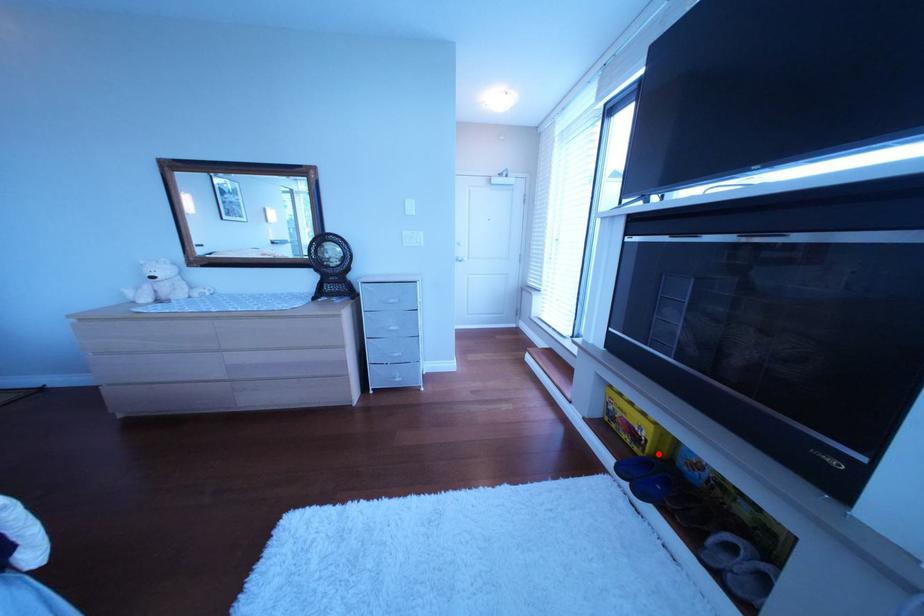
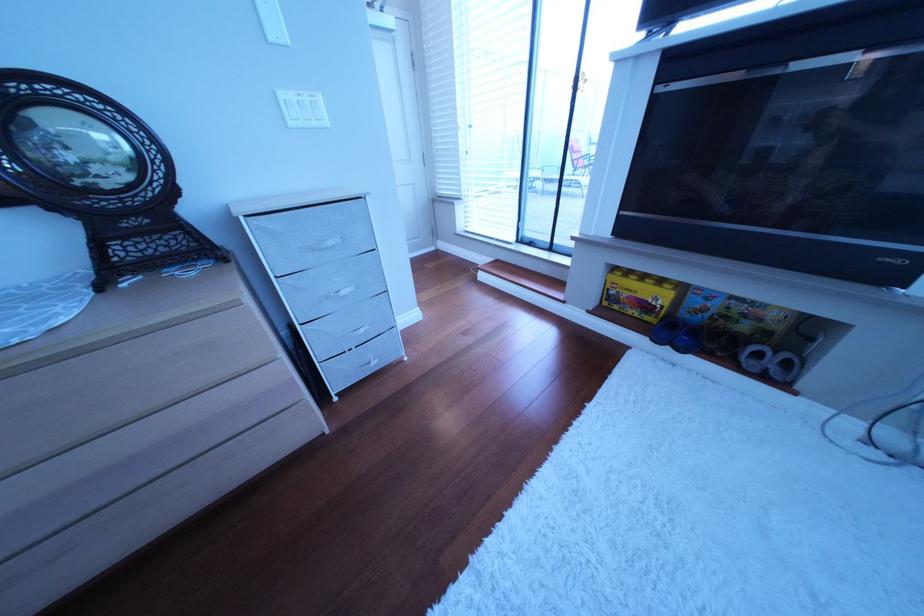
Question: I am providing you with two images of the same scene from different viewpoints. Image1 has a red point marked. In image2, the corresponding 3D location appears at what relative position? Reply with the corresponding letter.

Choices:
 (A) Closer
 (B) Farther

Answer: (A)